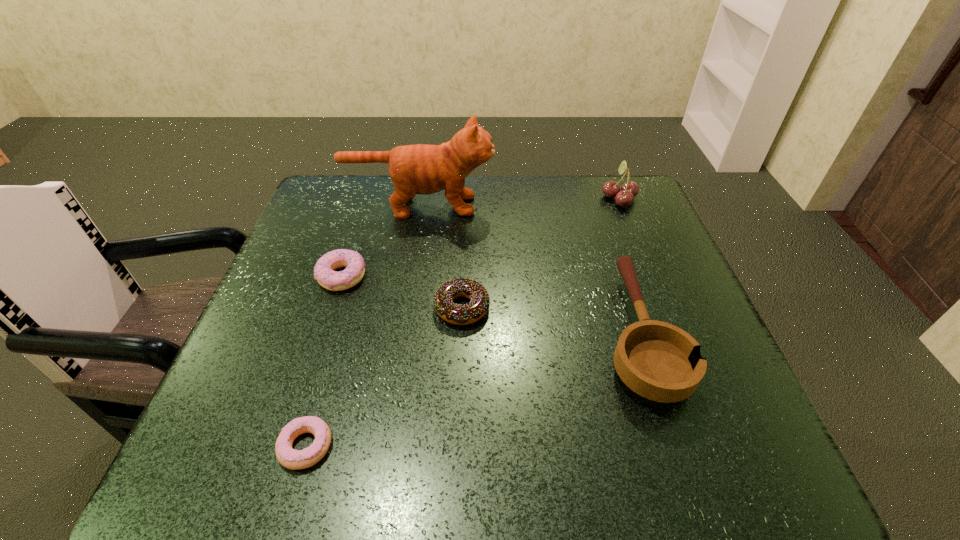
Where is `vacant space located 0.270m with the handle on the side of the saucepan`? This screenshot has width=960, height=540. vacant space located 0.270m with the handle on the side of the saucepan is located at coordinates (596, 206).

The width and height of the screenshot is (960, 540). I want to click on vacant space located with the handle on the side of the saucepan, so point(599,215).

Identify the location of free location located with the handle on the side of the saucepan. This screenshot has height=540, width=960. (601, 221).

The image size is (960, 540). What are the coordinates of `blank space located 0.210m on the right of the rightmost doughnut` in the screenshot? It's located at (589, 308).

Locate an element on the screen. This screenshot has height=540, width=960. free space located on the right of the shortest object is located at coordinates (530, 446).

This screenshot has height=540, width=960. In order to click on cat located in the far edge section of the desktop in this screenshot , I will do `click(424, 169)`.

I want to click on cherry at the far edge, so click(624, 197).

Identify the location of object situated at the near edge. The width and height of the screenshot is (960, 540). (288, 457).

The height and width of the screenshot is (540, 960). Identify the location of cat that is positioned at the left edge. (424, 169).

The height and width of the screenshot is (540, 960). Identify the location of cherry that is at the right edge. (624, 197).